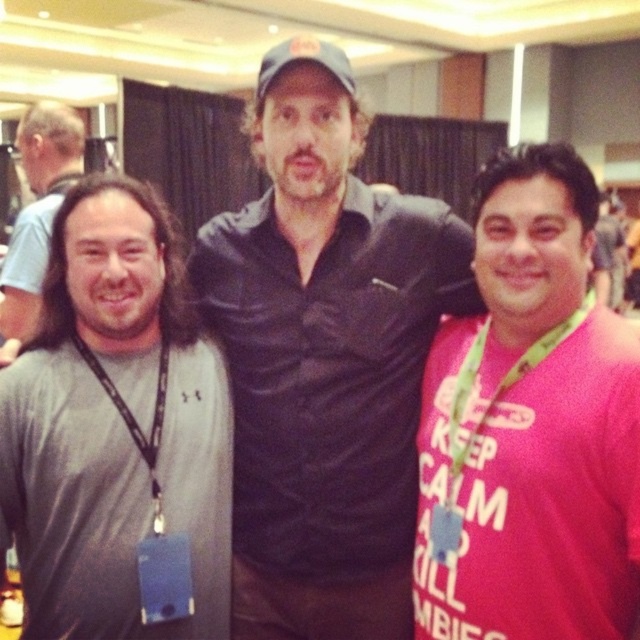
Question: Observing the image, what is the correct spatial positioning of gray fabric shirt at left in reference to green fabric lanyard at right?

Choices:
 (A) above
 (B) below

Answer: (B)

Question: Observing the image, what is the correct spatial positioning of pink fabric shirt at right in reference to black lanyard at left?

Choices:
 (A) below
 (B) above

Answer: (B)

Question: Does black matte shirt at center have a smaller size compared to gray fabric shirt at left?

Choices:
 (A) yes
 (B) no

Answer: (B)

Question: Which object is the closest to the black lanyard at left?

Choices:
 (A) black matte shirt at center
 (B) gray fabric shirt at left
 (C) gray lanyard at left
 (D) green fabric lanyard at right

Answer: (B)

Question: Considering the real-world distances, which object is farthest from the gray fabric shirt at left?

Choices:
 (A) pink fabric shirt at right
 (B) black lanyard at left
 (C) black matte shirt at center

Answer: (A)

Question: Which object is closer to the camera taking this photo?

Choices:
 (A) pink fabric shirt at right
 (B) black lanyard at left
 (C) black matte shirt at center

Answer: (A)